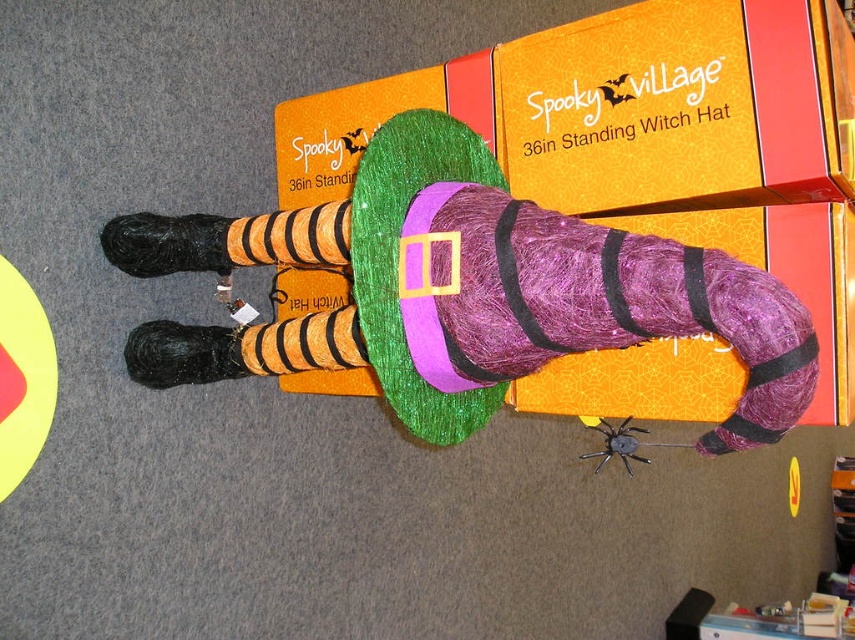
This screenshot has height=640, width=855. Find the location of `purple glittery witch hat at center`. purple glittery witch hat at center is located at coordinates (464, 292).

Between purple glittery witch hat at center and black matte spider at center, which one appears on the left side from the viewer's perspective?

purple glittery witch hat at center is more to the left.

The image size is (855, 640). What are the coordinates of `purple glittery witch hat at center` in the screenshot? It's located at (464, 292).

Who is more forward, [310,173] or [600,432]?

Point [600,432]

Can you confirm if green glittery witch hat at center is taller than black matte spider at center?

Yes.

Image resolution: width=855 pixels, height=640 pixels. Identify the location of green glittery witch hat at center. (373, 122).

From the picture: Measure the distance between point (x=361, y=291) and camera.

Point (x=361, y=291) is 1.12 meters from camera.

From the picture: Can you confirm if purple glittery witch hat at center is wider than green glittery witch hat at center?

Indeed, purple glittery witch hat at center has a greater width compared to green glittery witch hat at center.

Is point (358, 192) more distant than point (472, 58)?

No, (358, 192) is closer to viewer.

At what (x,y) coordinates should I click in order to perform the action: click on purple glittery witch hat at center. Please return your answer as a coordinate pair (x, y). This screenshot has width=855, height=640. Looking at the image, I should click on (464, 292).